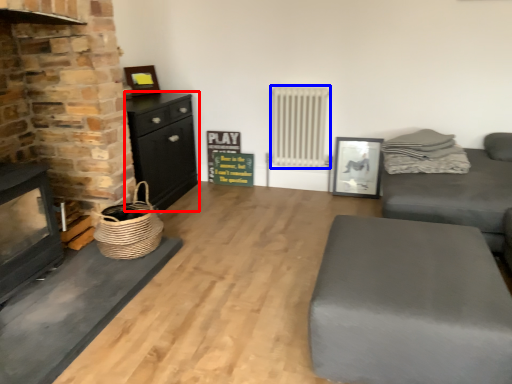
Question: Which object is closer to the camera taking this photo, chest of drawers (highlighted by a red box) or radiator (highlighted by a blue box)?

Choices:
 (A) chest of drawers
 (B) radiator

Answer: (A)